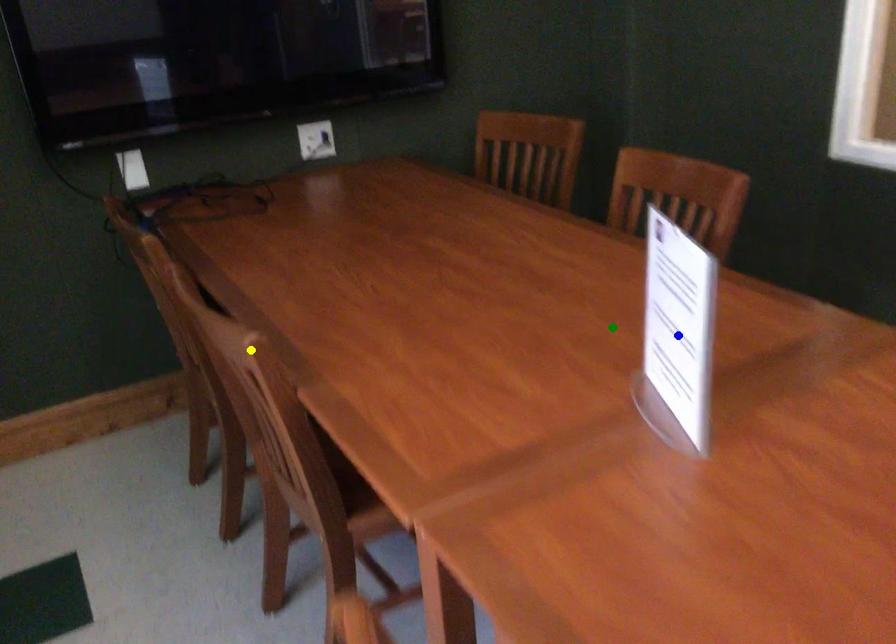
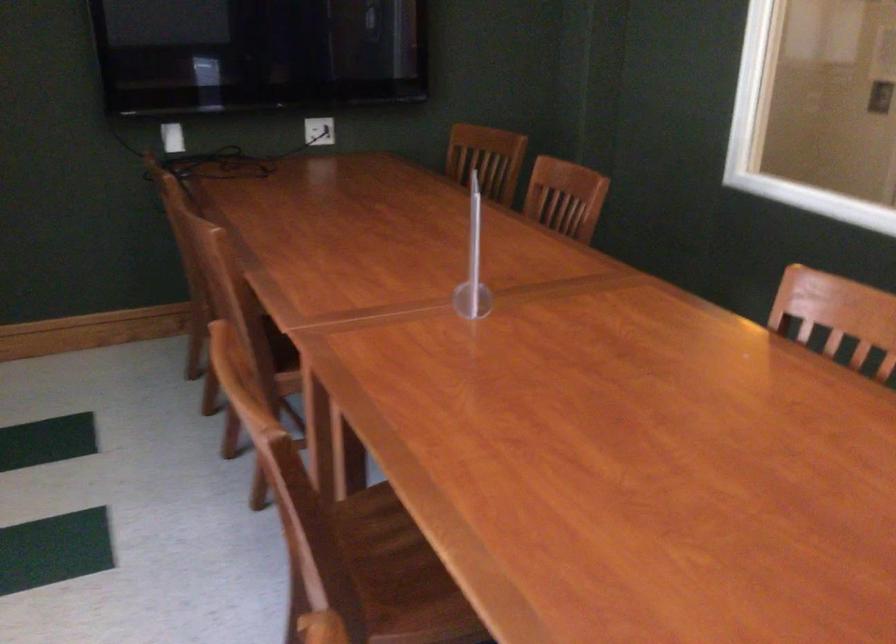
I am providing you with two images of the same scene from different viewpoints. Three points are marked in image1. Which point corresponds to a part or object that is occluded in image2?In image1, three points are marked. Which of them correspond to a part or object that is occluded in image2?Among the three points shown in image1, which one corresponds to a part or object that is no longer visible due to occlusion in image2?

blue point